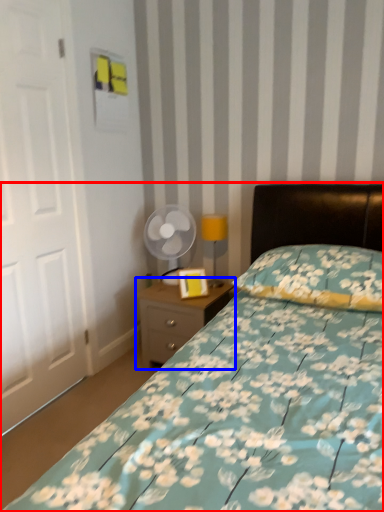
Question: Which object appears farthest to the camera in this image, bed (highlighted by a red box) or nightstand (highlighted by a blue box)?

Choices:
 (A) bed
 (B) nightstand

Answer: (B)